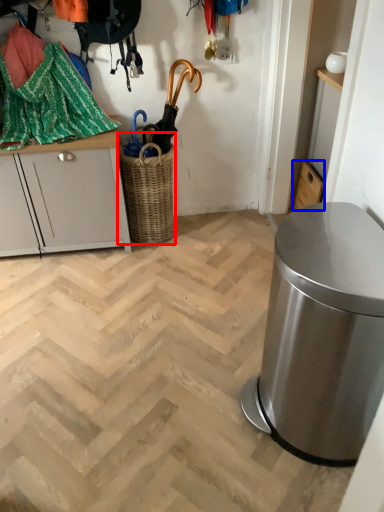
Question: Which point is further to the camera, basket (highlighted by a red box) or cabinetry (highlighted by a blue box)?

Choices:
 (A) basket
 (B) cabinetry

Answer: (B)